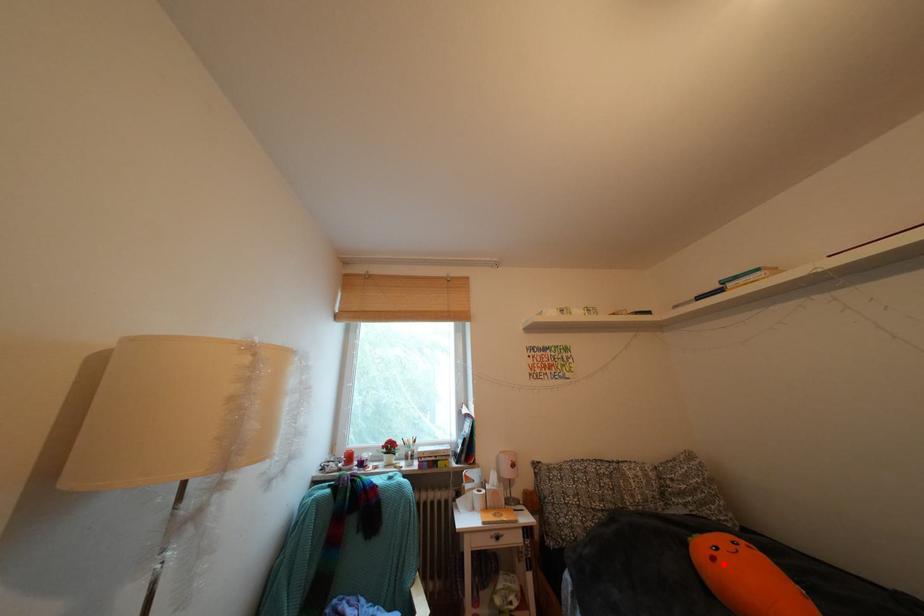
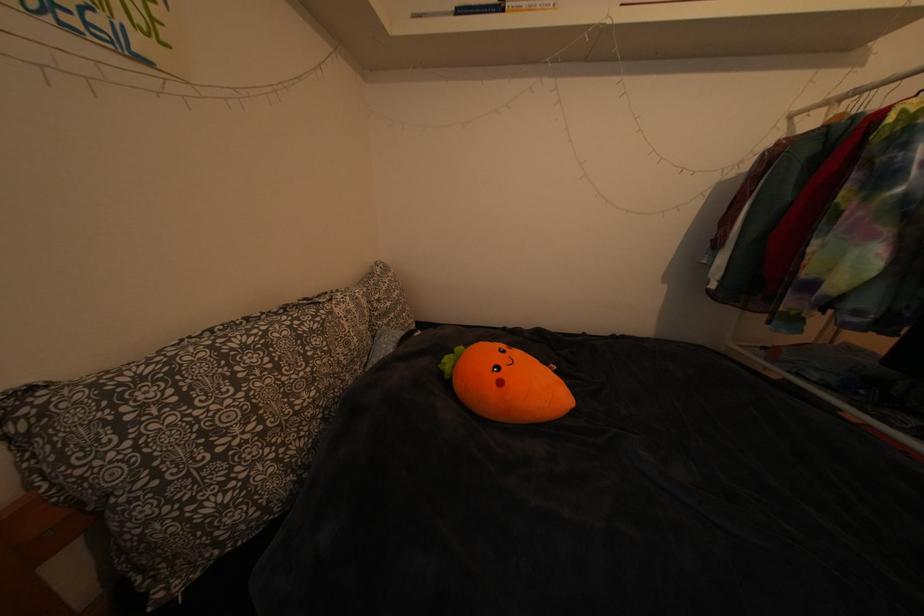
In the second image, find the point that corresponds to the highlighted location in the first image.

(511, 389)